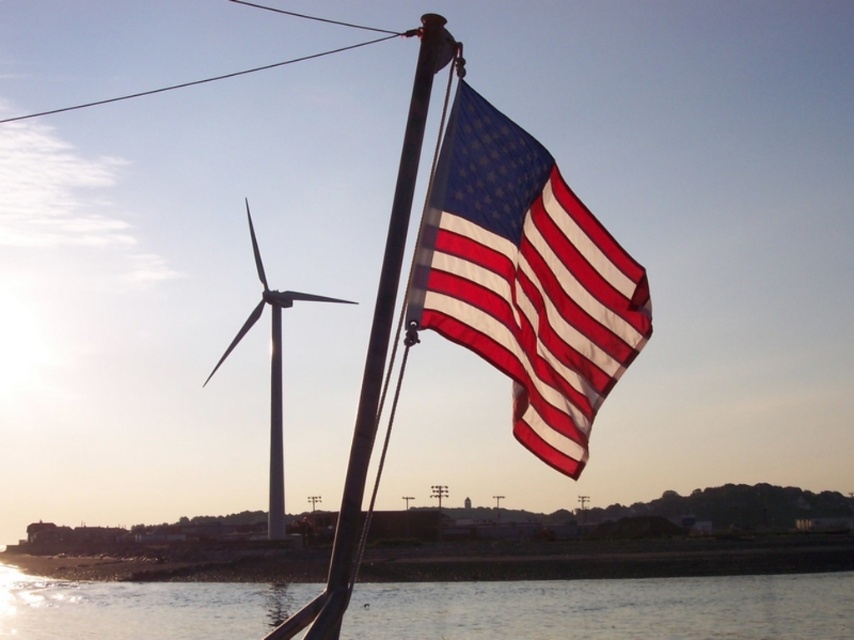
Question: Which point is closer to the camera taking this photo?

Choices:
 (A) (287, 298)
 (B) (718, 611)
 (C) (379, 273)
 (D) (469, 134)

Answer: (C)

Question: Is transparent water at lower center below metallic flag pole at center?

Choices:
 (A) no
 (B) yes

Answer: (B)

Question: Estimate the real-world distances between objects in this image. Which object is closer to the white smooth wind turbine at left?

Choices:
 (A) metallic flag pole at center
 (B) transparent water at lower center
 (C) american flag at center

Answer: (B)

Question: Estimate the real-world distances between objects in this image. Which object is closer to the transparent water at lower center?

Choices:
 (A) white smooth wind turbine at left
 (B) american flag at center

Answer: (B)

Question: Can you confirm if transparent water at lower center is wider than metallic flag pole at center?

Choices:
 (A) no
 (B) yes

Answer: (B)

Question: Can you confirm if american flag at center is positioned below transparent water at lower center?

Choices:
 (A) no
 (B) yes

Answer: (A)